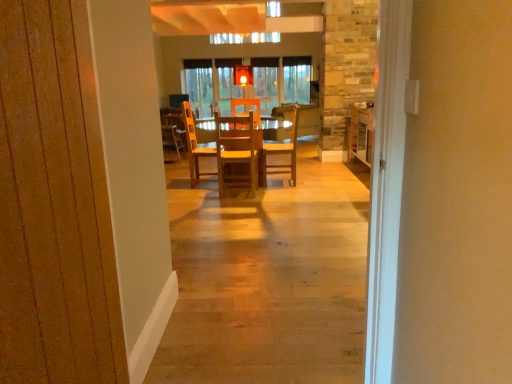
Measure the distance between wooden chair at center, the 1th chair in the left-to-right sequence, and camera.

They are 18.01 feet apart.

This screenshot has width=512, height=384. What do you see at coordinates (238, 153) in the screenshot?
I see `wooden chair at center, the first chair positioned from the front` at bounding box center [238, 153].

Locate an element on the screen. Image resolution: width=512 pixels, height=384 pixels. wooden at center, the second chair when ordered from right to left is located at coordinates (194, 145).

Where is `wooden chair at center, which is counted as the 4th chair, starting from the front`? Image resolution: width=512 pixels, height=384 pixels. wooden chair at center, which is counted as the 4th chair, starting from the front is located at coordinates pyautogui.click(x=173, y=131).

Is wooden at center, placed as the 3th chair when sorted from left to right, oriented away from wooden chair at center, placed as the 4th chair when sorted from right to left?

wooden at center, placed as the 3th chair when sorted from left to right, does not have its back to wooden chair at center, placed as the 4th chair when sorted from right to left.

Who is smaller, wooden at center, placed as the second chair when sorted from front to back, or wooden chair at center, arranged as the 1th chair when viewed from the back?

With smaller size is wooden chair at center, arranged as the 1th chair when viewed from the back.

From a real-world perspective, is wooden at center, placed as the second chair when sorted from front to back, physically located above or below wooden chair at center, arranged as the 1th chair when viewed from the back?

wooden at center, placed as the second chair when sorted from front to back, is below wooden chair at center, arranged as the 1th chair when viewed from the back.

From the image's perspective, which is below, wooden at center, the second chair when ordered from right to left, or wooden chair at center, which is counted as the 4th chair, starting from the back?

From the image's view, wooden chair at center, which is counted as the 4th chair, starting from the back, is below.

Does wooden at center, the second chair when ordered from right to left, lie behind wooden chair at center, which is counted as the 4th chair, starting from the back?

Yes, wooden at center, the second chair when ordered from right to left, is further from the camera.

Consider the image. Is wooden at center, placed as the 3th chair when sorted from left to right, not inside wooden chair at center, the 2th chair from the left?

wooden at center, placed as the 3th chair when sorted from left to right, lies outside wooden chair at center, the 2th chair from the left,'s area.

Is wooden at center, the second chair when ordered from right to left, at the right side of wooden chair at center, the 2th chair from the left?

Yes.

Which of these two, wooden chair at center, placed as the 4th chair when sorted from right to left, or wooden at center, which is the third chair from back to front, stands shorter?

Standing shorter between the two is wooden at center, which is the third chair from back to front.

Is wooden chair at center, which is counted as the 4th chair, starting from the front, beside wooden at center, placed as the second chair when sorted from front to back?

No, wooden chair at center, which is counted as the 4th chair, starting from the front, is not touching wooden at center, placed as the second chair when sorted from front to back.

Is wooden chair at center, arranged as the 1th chair when viewed from the back, facing towards wooden at center, placed as the second chair when sorted from front to back?

No, wooden chair at center, arranged as the 1th chair when viewed from the back, is not aimed at wooden at center, placed as the second chair when sorted from front to back.

In the image, is wooden chair at center, which is counted as the 4th chair, starting from the front, on the left side or the right side of wooden at center, the second chair when ordered from right to left?

In the image, wooden chair at center, which is counted as the 4th chair, starting from the front, appears on the left side of wooden at center, the second chair when ordered from right to left.

Is wooden at center, which is the third chair from back to front, positioned with its back to wooden chair at center, which is counted as the third chair, starting from the front?

No, wooden chair at center, which is counted as the third chair, starting from the front, is not at the back of wooden at center, which is the third chair from back to front.

From the image's perspective, is wooden at center, the second chair when ordered from right to left, positioned above or below wooden chair at center, the 4th chair positioned from the left?

wooden at center, the second chair when ordered from right to left, is below wooden chair at center, the 4th chair positioned from the left.

In the scene shown: Which of these two, wooden at center, placed as the second chair when sorted from front to back, or wooden chair at center, which is the 2th chair in back-to-front order, is bigger?

Bigger between the two is wooden at center, placed as the second chair when sorted from front to back.

Consider the image. Can you tell me how much wooden at center, the second chair when ordered from right to left, and wooden chair at center, the 4th chair positioned from the left, differ in facing direction?

They differ by 90.3 degrees in their facing directions.

From the image's perspective, which one is positioned lower, wooden chair at center, arranged as the 1th chair when viewed from the right, or wooden chair at center, arranged as the 1th chair when viewed from the back?

From the image's view, wooden chair at center, arranged as the 1th chair when viewed from the right, is below.

Measure the distance between wooden chair at center, the 4th chair positioned from the left, and wooden chair at center, arranged as the 1th chair when viewed from the back.

wooden chair at center, the 4th chair positioned from the left, is 4.93 feet away from wooden chair at center, arranged as the 1th chair when viewed from the back.

Starting from the wooden chair at center, the 1th chair in the left-to-right sequence, which chair is the 1st one in front? Please provide its 2D coordinates.

[(284, 151)]

Does point (292, 165) appear closer or farther from the camera than point (169, 134)?

Point (292, 165) is closer to the camera than point (169, 134).

From the picture: Would you consider wooden chair at center, placed as the 4th chair when sorted from right to left, to be distant from wooden chair at center, the 2th chair from the left?

wooden chair at center, placed as the 4th chair when sorted from right to left, is near wooden chair at center, the 2th chair from the left, not far away.

Is point (173, 135) closer to camera compared to point (238, 167)?

No.

Is wooden chair at center, placed as the 4th chair when sorted from right to left, oriented away from wooden chair at center, the first chair positioned from the front?

No, wooden chair at center, placed as the 4th chair when sorted from right to left, is not facing away from wooden chair at center, the first chair positioned from the front.

Between wooden chair at center, placed as the 4th chair when sorted from right to left, and wooden chair at center, which is the third chair in right-to-left order, which one has more height?

Standing taller between the two is wooden chair at center, which is the third chair in right-to-left order.

Where is `the 3rd chair above when counting from the wooden chair at center, the first chair positioned from the front (from the image's perspective)`? The image size is (512, 384). the 3rd chair above when counting from the wooden chair at center, the first chair positioned from the front (from the image's perspective) is located at coordinates (173, 131).

From a real-world perspective, is wooden chair at center, the 2th chair from the left, located beneath wooden chair at center, arranged as the 1th chair when viewed from the back?

No, from a real-world perspective, wooden chair at center, the 2th chair from the left, is not beneath wooden chair at center, arranged as the 1th chair when viewed from the back.

Between wooden chair at center, which is counted as the 4th chair, starting from the back, and wooden chair at center, arranged as the 1th chair when viewed from the back, which one is positioned behind?

wooden chair at center, arranged as the 1th chair when viewed from the back, is behind.

Consider the image. Is wooden chair at center, the first chair positioned from the front, bigger or smaller than wooden chair at center, the 1th chair in the left-to-right sequence?

wooden chair at center, the first chair positioned from the front, is smaller than wooden chair at center, the 1th chair in the left-to-right sequence.

Where is `the 1st chair positioned above the wooden at center, placed as the 3th chair when sorted from left to right (from a real-world perspective)`? the 1st chair positioned above the wooden at center, placed as the 3th chair when sorted from left to right (from a real-world perspective) is located at coordinates (173, 131).

Identify the location of chair that is the 3rd object directly below the wooden chair at center, which is counted as the 4th chair, starting from the back (from a real-world perspective). The height and width of the screenshot is (384, 512). (194, 145).

Which object lies nearer to the anchor point wooden at center, placed as the 3th chair when sorted from left to right, wooden chair at center, which is counted as the 4th chair, starting from the front, or wooden chair at center, which is the third chair in right-to-left order?

Based on the image, wooden chair at center, which is counted as the 4th chair, starting from the front, appears to be nearer to wooden at center, placed as the 3th chair when sorted from left to right.

Considering their positions, is wooden chair at center, arranged as the 1th chair when viewed from the right, positioned closer to wooden chair at center, the 2th chair from the left, than wooden at center, the second chair when ordered from right to left?

wooden chair at center, arranged as the 1th chair when viewed from the right, is positioned closer to the anchor wooden chair at center, the 2th chair from the left.

When comparing their distances from wooden chair at center, the 4th chair positioned from the left, does wooden at center, the second chair when ordered from right to left, or wooden chair at center, the 1th chair in the left-to-right sequence, seem closer?

Among the two, wooden at center, the second chair when ordered from right to left, is located nearer to wooden chair at center, the 4th chair positioned from the left.

Looking at the image, which one is located closer to wooden at center, which is the third chair from back to front, wooden chair at center, the first chair positioned from the front, or wooden chair at center, the 4th chair positioned from the left?

Answer: wooden chair at center, the first chair positioned from the front, is closer to wooden at center, which is the third chair from back to front.

Based on their spatial positions, is wooden chair at center, the 2th chair from the left, or wooden chair at center, placed as the 4th chair when sorted from right to left, closer to wooden at center, which is the third chair from back to front?

wooden chair at center, placed as the 4th chair when sorted from right to left, is positioned closer to the anchor wooden at center, which is the third chair from back to front.

Looking at this image, considering their positions, is wooden chair at center, which is the 2th chair in back-to-front order, positioned closer to wooden at center, placed as the second chair when sorted from front to back, than wooden chair at center, arranged as the 1th chair when viewed from the back?

Among the two, wooden chair at center, arranged as the 1th chair when viewed from the back, is located nearer to wooden at center, placed as the second chair when sorted from front to back.

Based on their spatial positions, is wooden at center, the second chair when ordered from right to left, or wooden chair at center, arranged as the 1th chair when viewed from the right, closer to wooden chair at center, which is counted as the 4th chair, starting from the back?

wooden chair at center, arranged as the 1th chair when viewed from the right.

Based on their spatial positions, is wooden chair at center, which is the 2th chair in back-to-front order, or wooden chair at center, which is counted as the 4th chair, starting from the back, closer to wooden at center, the second chair when ordered from right to left?

Based on the image, wooden chair at center, which is counted as the 4th chair, starting from the back, appears to be nearer to wooden at center, the second chair when ordered from right to left.

Find the location of `chair situated between wooden chair at center, which is the third chair in right-to-left order, and wooden chair at center, which is the 2th chair in back-to-front order, from left to right`. chair situated between wooden chair at center, which is the third chair in right-to-left order, and wooden chair at center, which is the 2th chair in back-to-front order, from left to right is located at coordinates 194,145.

The image size is (512, 384). What are the coordinates of `chair between wooden at center, placed as the second chair when sorted from front to back, and wooden chair at center, placed as the 4th chair when sorted from right to left, along the z-axis` in the screenshot? It's located at (284, 151).